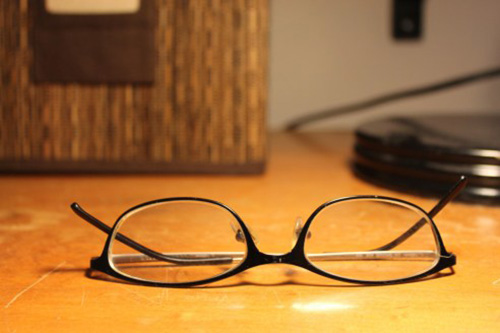
Locate an element on the screen. wooden table is located at coordinates (182, 325).